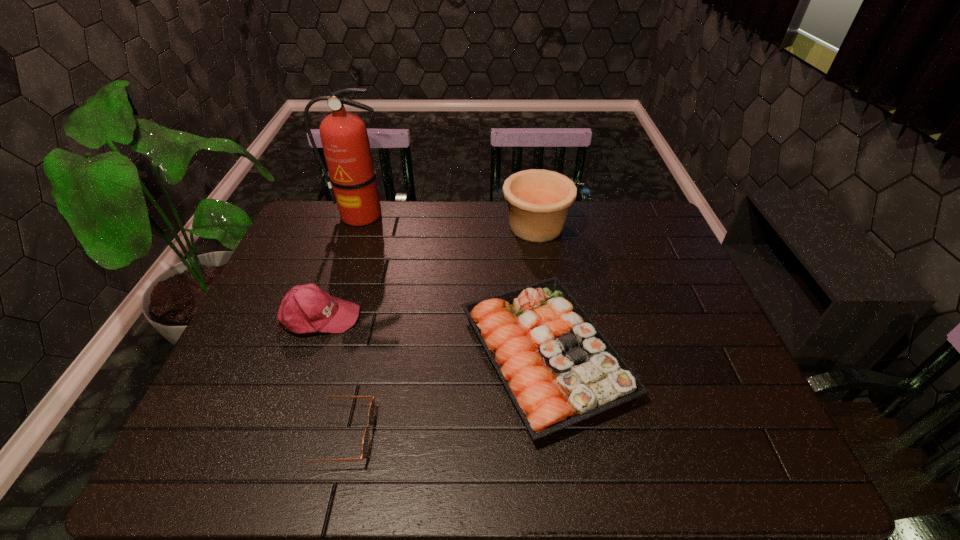
Where is `vacant region at the right edge of the desktop`? The image size is (960, 540). vacant region at the right edge of the desktop is located at coordinates (708, 339).

In the image, there is a desktop. At what (x,y) coordinates should I click in order to perform the action: click on vacant region at the far left corner. Please return your answer as a coordinate pair (x, y). The width and height of the screenshot is (960, 540). Looking at the image, I should click on [x=344, y=231].

Where is `vacant area at the near right corner of the desktop`? The image size is (960, 540). vacant area at the near right corner of the desktop is located at coordinates (703, 454).

At what (x,y) coordinates should I click in order to perform the action: click on empty space that is in between the third shortest object and the tallest object. Please return your answer as a coordinate pair (x, y). This screenshot has height=540, width=960. Looking at the image, I should click on (340, 266).

Where is `free space between the fire extinguisher and the second tallest object`? The height and width of the screenshot is (540, 960). free space between the fire extinguisher and the second tallest object is located at coordinates (448, 221).

Where is `vacant space in between the pottery and the fire extinguisher`? The image size is (960, 540). vacant space in between the pottery and the fire extinguisher is located at coordinates (448, 221).

This screenshot has width=960, height=540. I want to click on vacant space in between the tallest object and the pottery, so click(448, 221).

The width and height of the screenshot is (960, 540). Identify the location of free space that is in between the fire extinguisher and the platter. (453, 285).

Find the location of a particular element. This screenshot has width=960, height=540. free space that is in between the sunglasses and the second tallest object is located at coordinates 437,330.

Locate an element on the screen. The height and width of the screenshot is (540, 960). free space between the sunglasses and the platter is located at coordinates (442, 394).